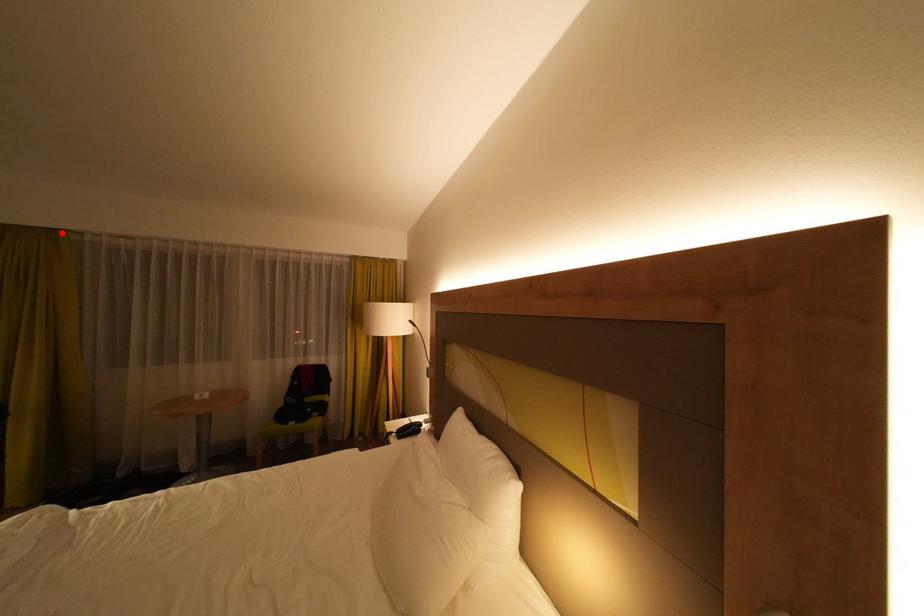
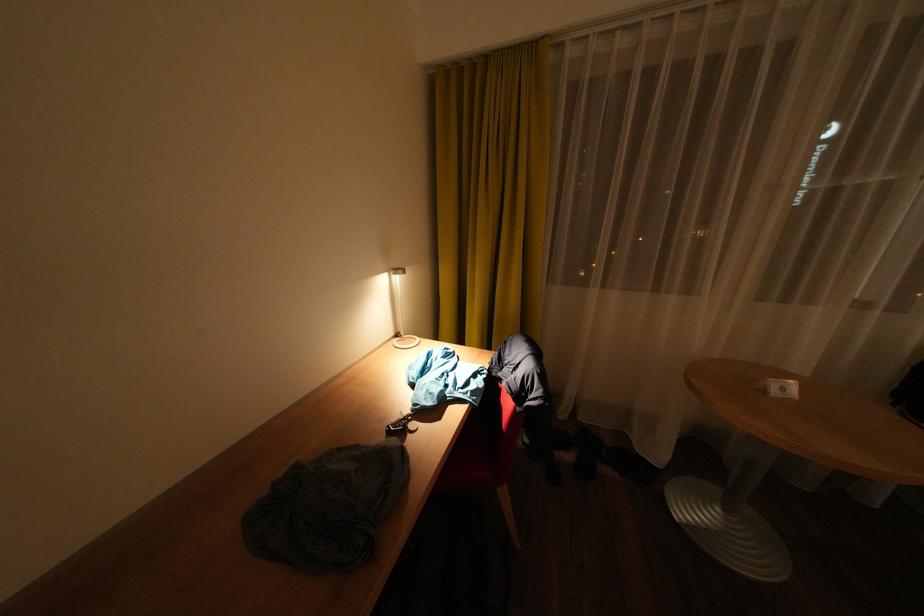
Locate, in the second image, the point that corresponds to the highlighted location in the first image.

(544, 47)